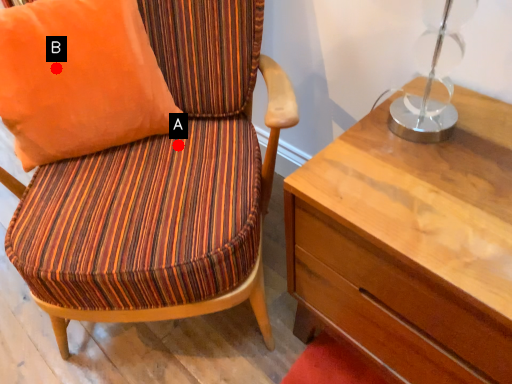
Question: Two points are circled on the image, labeled by A and B beside each circle. Which point appears farthest from the camera in this image?

Choices:
 (A) A is further
 (B) B is further

Answer: (A)